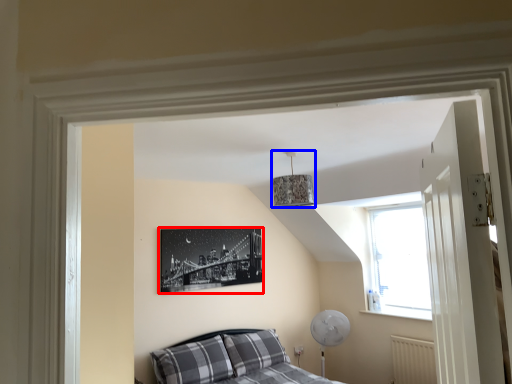
Question: Among these objects, which one is nearest to the camera, picture frame (highlighted by a red box) or lamp (highlighted by a blue box)?

Choices:
 (A) picture frame
 (B) lamp

Answer: (B)